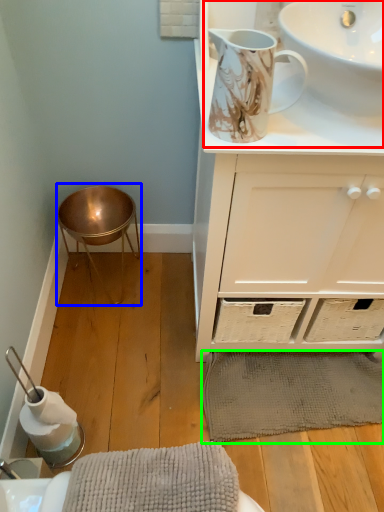
Question: Which object is the farthest from sink (highlighted by a red box)? Choose among these: bar stool (highlighted by a blue box) or bath mat (highlighted by a green box).

Choices:
 (A) bar stool
 (B) bath mat

Answer: (B)